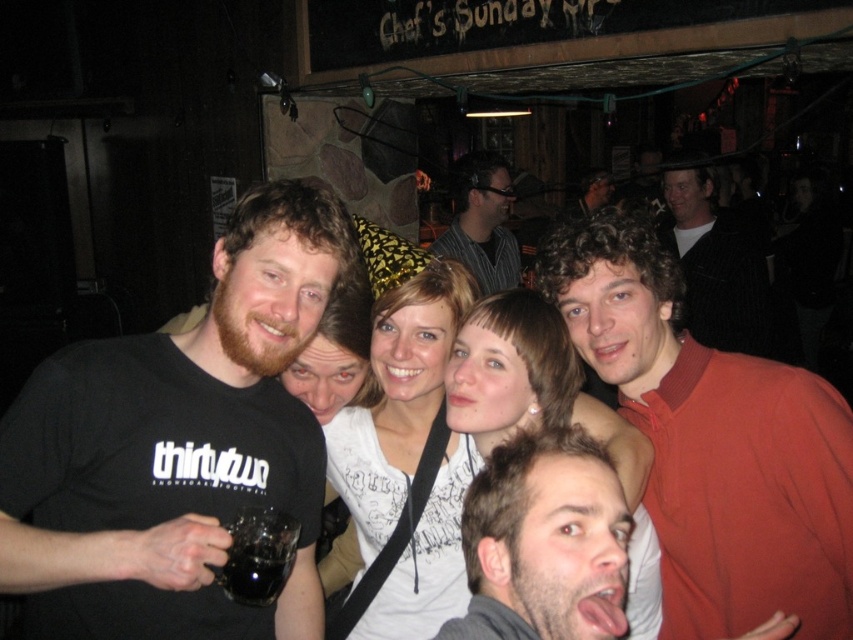
What do you see at coordinates (177, 445) in the screenshot? The height and width of the screenshot is (640, 853). I see `black matte t-shirt at left` at bounding box center [177, 445].

Who is more distant from viewer, (164, 445) or (589, 349)?

Point (589, 349)

Is point (258, 316) positioned after point (802, 529)?

No.

This screenshot has height=640, width=853. I want to click on black matte t-shirt at left, so click(x=177, y=445).

Does black textured jacket at upper right have a greater width compared to striped fabric shirt at center?

Indeed, black textured jacket at upper right has a greater width compared to striped fabric shirt at center.

Does black textured jacket at upper right appear on the right side of striped fabric shirt at center?

Yes, black textured jacket at upper right is to the right of striped fabric shirt at center.

Find the location of a particular element. This screenshot has width=853, height=640. black textured jacket at upper right is located at coordinates (715, 268).

Does black matte t-shirt at left have a larger size compared to matte black shirt at center?

Incorrect, black matte t-shirt at left is not larger than matte black shirt at center.

In the scene shown: Which is above, black matte t-shirt at left or matte black shirt at center?

matte black shirt at center is higher up.

Is point (88, 467) positioned before point (595, 204)?

Yes, it is.

Where is `black matte t-shirt at left`? The height and width of the screenshot is (640, 853). black matte t-shirt at left is located at coordinates (177, 445).